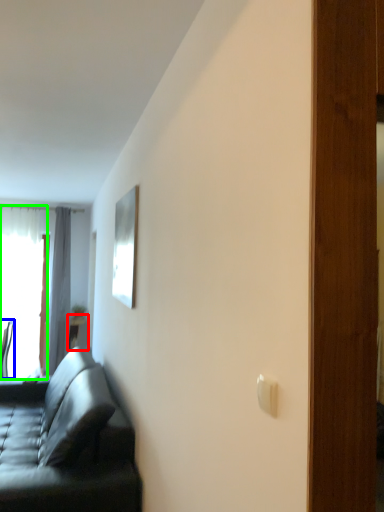
Question: Based on their relative distances, which object is nearer to table (highlighted by a red box)? Choose from chair (highlighted by a blue box) and window (highlighted by a green box).

Choices:
 (A) chair
 (B) window

Answer: (A)